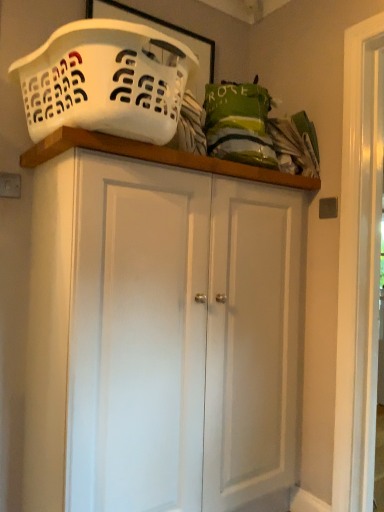
At what (x,y) coordinates should I click in order to perform the action: click on white plastic laundry basket at upper left. Please return your answer as a coordinate pair (x, y). The image size is (384, 512). Looking at the image, I should click on (105, 81).

Describe the element at coordinates (105, 81) in the screenshot. This screenshot has width=384, height=512. I see `white plastic laundry basket at upper left` at that location.

In order to face white matte cupboard at center, should I rotate leftwards or rightwards?

Rotate your view right by about 2.345°.

Image resolution: width=384 pixels, height=512 pixels. Find the location of `white matte cupboard at center`. white matte cupboard at center is located at coordinates (161, 328).

The image size is (384, 512). What do you see at coordinates (161, 328) in the screenshot?
I see `white matte cupboard at center` at bounding box center [161, 328].

Image resolution: width=384 pixels, height=512 pixels. In order to click on white plastic laundry basket at upper left in this screenshot , I will do `click(105, 81)`.

Is white matte cupboard at center at the left side of white plastic laundry basket at upper left?

No, white matte cupboard at center is not to the left of white plastic laundry basket at upper left.

Is white matte cupboard at center closer to the viewer compared to white plastic laundry basket at upper left?

No, it is behind white plastic laundry basket at upper left.

Is point (247, 254) positioned after point (163, 103)?

Yes, point (247, 254) is farther from viewer.

From the image's perspective, is white matte cupboard at center above white plastic laundry basket at upper left?

Actually, white matte cupboard at center appears below white plastic laundry basket at upper left in the image.

From a real-world perspective, between white matte cupboard at center and white plastic laundry basket at upper left, who is vertically higher?

white plastic laundry basket at upper left is physically above.

Considering the sizes of objects white matte cupboard at center and white plastic laundry basket at upper left in the image provided, who is wider, white matte cupboard at center or white plastic laundry basket at upper left?

white plastic laundry basket at upper left.

Considering the sizes of objects white matte cupboard at center and white plastic laundry basket at upper left in the image provided, who is shorter, white matte cupboard at center or white plastic laundry basket at upper left?

white plastic laundry basket at upper left.

Considering the relative sizes of white matte cupboard at center and white plastic laundry basket at upper left in the image provided, is white matte cupboard at center bigger than white plastic laundry basket at upper left?

Indeed, white matte cupboard at center has a larger size compared to white plastic laundry basket at upper left.

Is white plastic laundry basket at upper left completely or partially inside white matte cupboard at center?

No, white plastic laundry basket at upper left is not inside white matte cupboard at center.

Consider the image. Would you consider white matte cupboard at center to be distant from white plastic laundry basket at upper left?

No, white matte cupboard at center is in close proximity to white plastic laundry basket at upper left.

Is white plastic laundry basket at upper left at the back of white matte cupboard at center?

No.

Can you tell me how much white matte cupboard at center and white plastic laundry basket at upper left differ in facing direction?

The angle between the facing direction of white matte cupboard at center and the facing direction of white plastic laundry basket at upper left is 0.00404 degrees.

Image resolution: width=384 pixels, height=512 pixels. I want to click on cupboard that appears behind the white plastic laundry basket at upper left, so click(161, 328).

Between white plastic laundry basket at upper left and white matte cupboard at center, which one appears on the left side from the viewer's perspective?

Positioned to the left is white plastic laundry basket at upper left.

Looking at this image, which object is further away from the camera taking this photo, white plastic laundry basket at upper left or white matte cupboard at center?

white matte cupboard at center is behind.

Does point (62, 91) lie behind point (58, 337)?

No, (62, 91) is closer to viewer.

From the image's perspective, who appears lower, white plastic laundry basket at upper left or white matte cupboard at center?

From the image's view, white matte cupboard at center is below.

From a real-world perspective, is white plastic laundry basket at upper left under white matte cupboard at center?

No, from a real-world perspective, white plastic laundry basket at upper left is not beneath white matte cupboard at center.

Is white plastic laundry basket at upper left thinner than white matte cupboard at center?

In fact, white plastic laundry basket at upper left might be wider than white matte cupboard at center.

Is white plastic laundry basket at upper left taller than white matte cupboard at center?

In fact, white plastic laundry basket at upper left may be shorter than white matte cupboard at center.

Does white plastic laundry basket at upper left have a larger size compared to white matte cupboard at center?

Incorrect, white plastic laundry basket at upper left is not larger than white matte cupboard at center.

From the picture: Is white plastic laundry basket at upper left situated inside white matte cupboard at center or outside?

The correct answer is: outside.

Are white plastic laundry basket at upper left and white matte cupboard at center far apart?

They are positioned close to each other.

Is white plastic laundry basket at upper left aimed at white matte cupboard at center?

No, white plastic laundry basket at upper left is not facing towards white matte cupboard at center.

Can you tell me how much white plastic laundry basket at upper left and white matte cupboard at center differ in facing direction?

0.00404 degrees separate the facing orientations of white plastic laundry basket at upper left and white matte cupboard at center.

Identify the location of cupboard on the right of white plastic laundry basket at upper left. (161, 328).

This screenshot has height=512, width=384. Find the location of `basket container on the left of white matte cupboard at center`. basket container on the left of white matte cupboard at center is located at coordinates (105, 81).

I want to click on basket container located above the white matte cupboard at center (from the image's perspective), so click(105, 81).